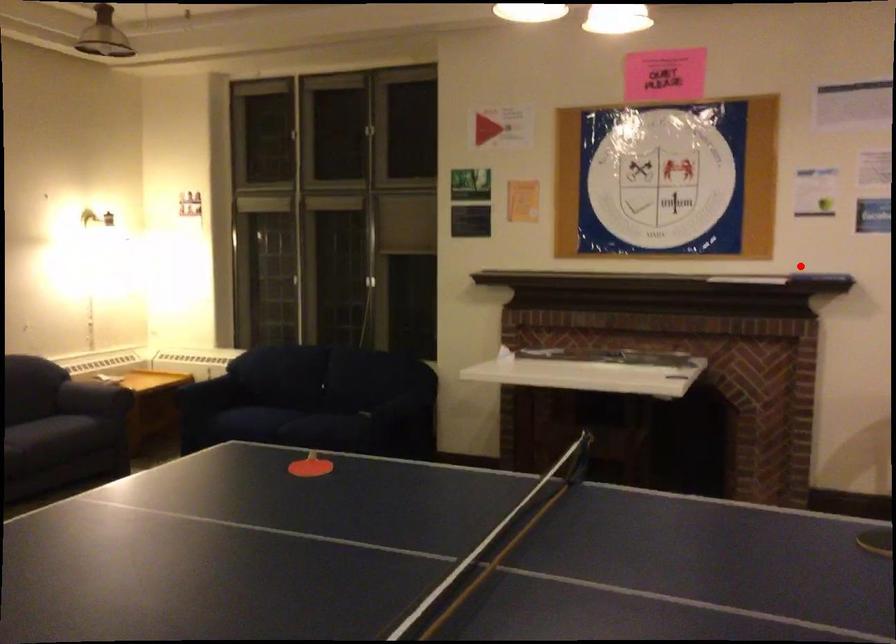
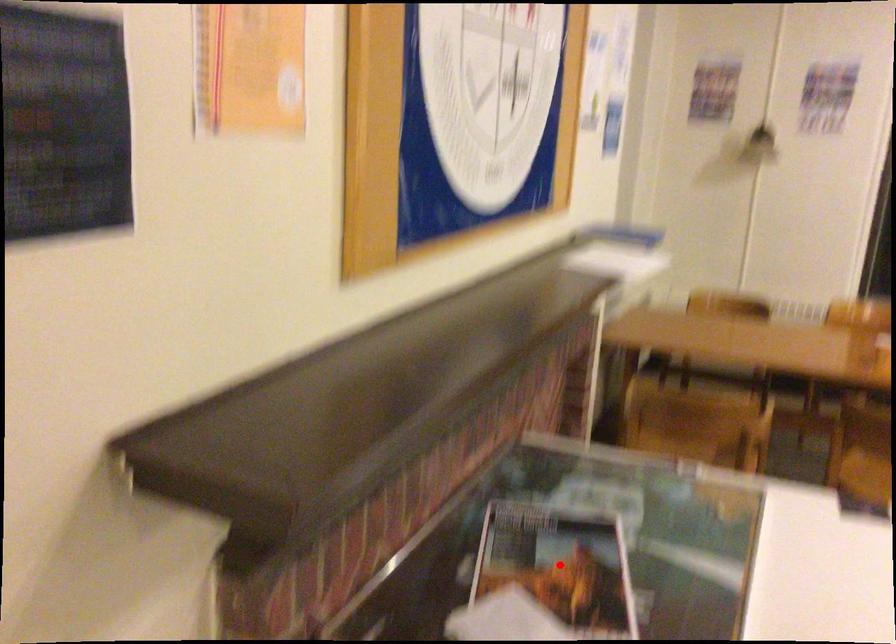
I am providing you with two images of the same scene from different viewpoints. A red point is marked on the first image and another point is marked on the second image. Does the point marked in image1 correspond to the same location as the one in image2?

No